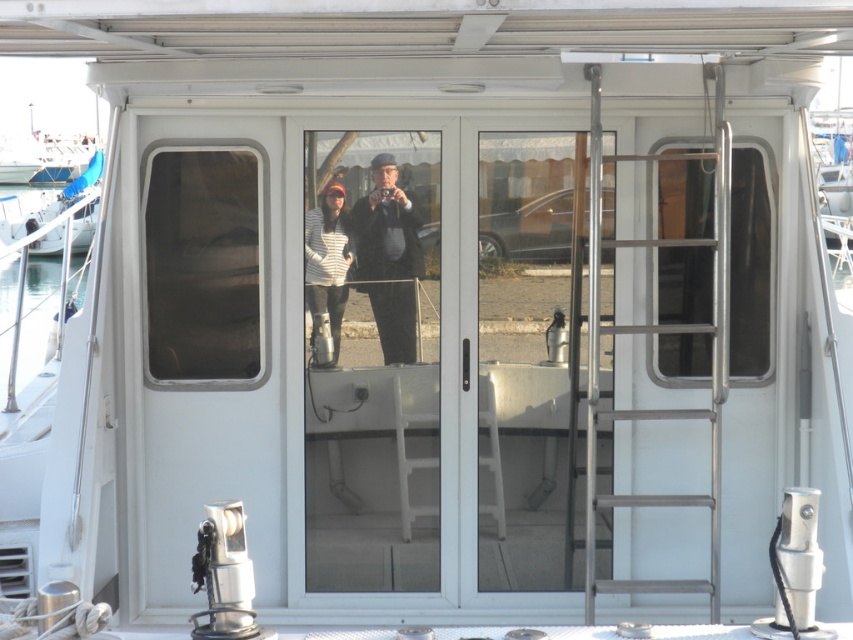
Between matte black camera at center and white glossy boat at left, which one has more height?

white glossy boat at left

This screenshot has width=853, height=640. Describe the element at coordinates (387, 259) in the screenshot. I see `matte black camera at center` at that location.

Is point (393, 353) positioned before point (22, 227)?

That is True.

Identify the location of matte black camera at center. (387, 259).

Between matte black camera at center and striped sweater at center, which one has less height?

Standing shorter between the two is striped sweater at center.

How much distance is there between matte black camera at center and striped sweater at center?

The distance of matte black camera at center from striped sweater at center is 5.44 inches.

Locate an element on the screen. The width and height of the screenshot is (853, 640). matte black camera at center is located at coordinates (x=387, y=259).

Does striped sweater at center have a greater height compared to white glossy boat at left?

No.

Does striped sweater at center appear under white glossy boat at left?

Yes, striped sweater at center is below white glossy boat at left.

Which is in front, point (314, 273) or point (57, 227)?

Point (314, 273)

Find the location of a particular element. striped sweater at center is located at coordinates (328, 272).